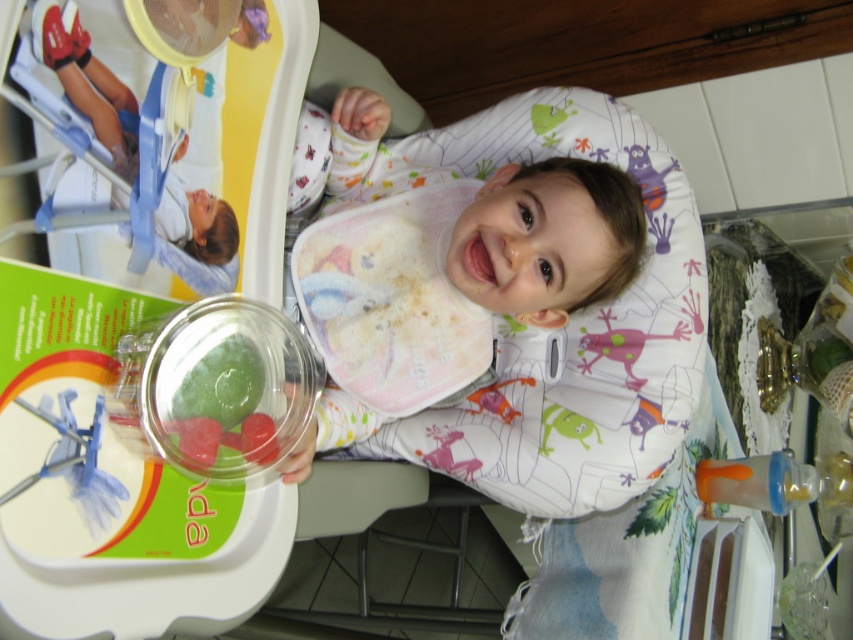
Question: Which point is closer to the camera?

Choices:
 (A) green translucent gummy at center
 (B) white fabric bib at center

Answer: (A)

Question: Is white fabric bib at center above clear plastic spoon at upper left?

Choices:
 (A) yes
 (B) no

Answer: (A)

Question: Which point is farther to the camera?

Choices:
 (A) (96, 403)
 (B) (631, 243)
 (C) (631, 381)
 (D) (234, 365)

Answer: (C)

Question: Which of the following is the farthest from the observer?

Choices:
 (A) (189, 380)
 (B) (80, 442)
 (C) (447, 252)
 (D) (589, 333)

Answer: (D)

Question: In this image, where is clear plastic spoon at upper left located relative to pink fabric toy at center?

Choices:
 (A) below
 (B) above

Answer: (A)

Question: Is white fabric bib at center smaller than clear plastic spoon at upper left?

Choices:
 (A) yes
 (B) no

Answer: (B)